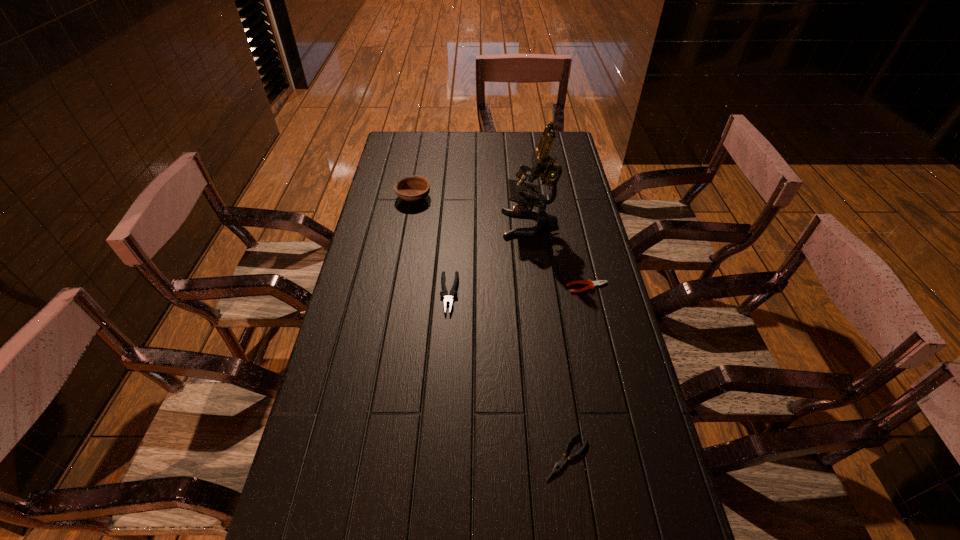
The width and height of the screenshot is (960, 540). Find the location of `the tallest object`. the tallest object is located at coordinates (543, 164).

The width and height of the screenshot is (960, 540). Identify the location of microscope. (543, 164).

I want to click on bowl, so click(411, 188).

You are a GUI agent. You are given a task and a screenshot of the screen. Output one action in this format:
    pyautogui.click(x=<x>, y=<y>)
    Task: Click on the farthest object
    The height and width of the screenshot is (540, 960).
    Given the screenshot: What is the action you would take?
    pyautogui.click(x=411, y=188)

Find the location of `the tallest pliers`. the tallest pliers is located at coordinates (453, 293).

What are the coordinates of `the second object from left to right` in the screenshot? It's located at (453, 293).

Locate an element on the screen. the second pliers from left to right is located at coordinates [558, 466].

Locate an element on the screen. the nearest pliers is located at coordinates (558, 466).

What are the coordinates of `the rightmost pliers` in the screenshot? It's located at [592, 284].

Locate an element on the screen. The width and height of the screenshot is (960, 540). free space located at the eyepieces of the microscope is located at coordinates (463, 224).